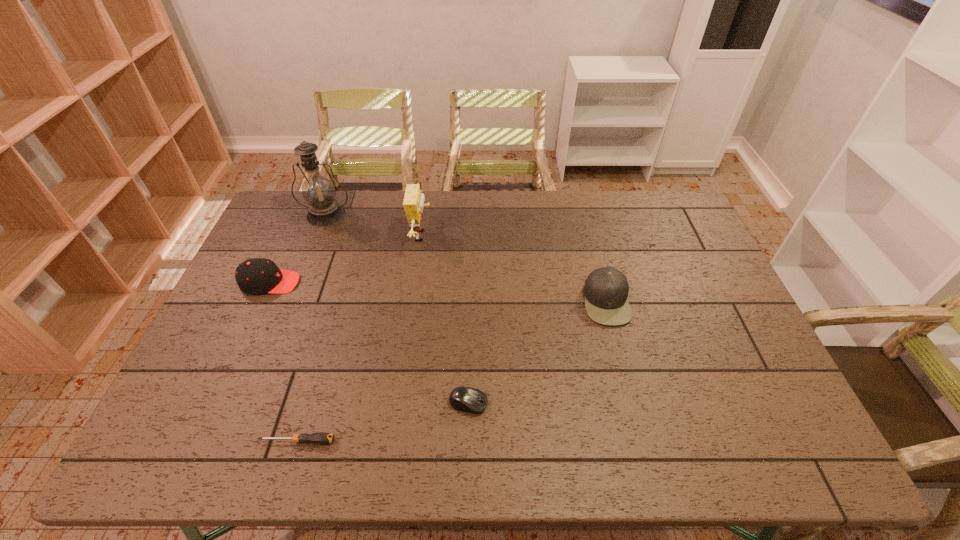
Locate an element on the screen. Image resolution: width=960 pixels, height=540 pixels. free spot that satisfies the following two spatial constraints: 1. on the front-facing side of the shortest object; 2. on the left side of the left cap is located at coordinates (199, 441).

Locate an element on the screen. vacant region that satisfies the following two spatial constraints: 1. on the front side of the tallest object; 2. on the front-facing side of the left cap is located at coordinates pyautogui.click(x=300, y=282).

Where is `vacant space that satisfies the following two spatial constraints: 1. on the front-facing side of the fifth object from left to right; 2. on the left side of the left cap`? The height and width of the screenshot is (540, 960). vacant space that satisfies the following two spatial constraints: 1. on the front-facing side of the fifth object from left to right; 2. on the left side of the left cap is located at coordinates (215, 403).